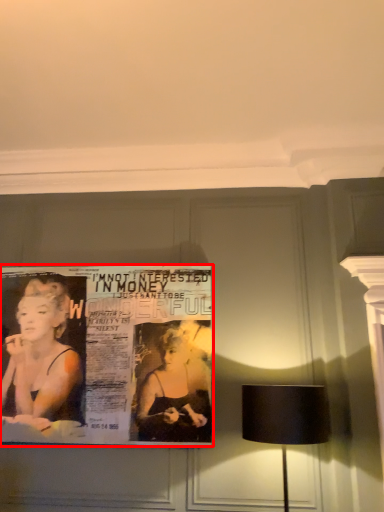
Question: From the image's perspective, where is poster (annotated by the red box) located relative to lamp?

Choices:
 (A) below
 (B) above

Answer: (B)